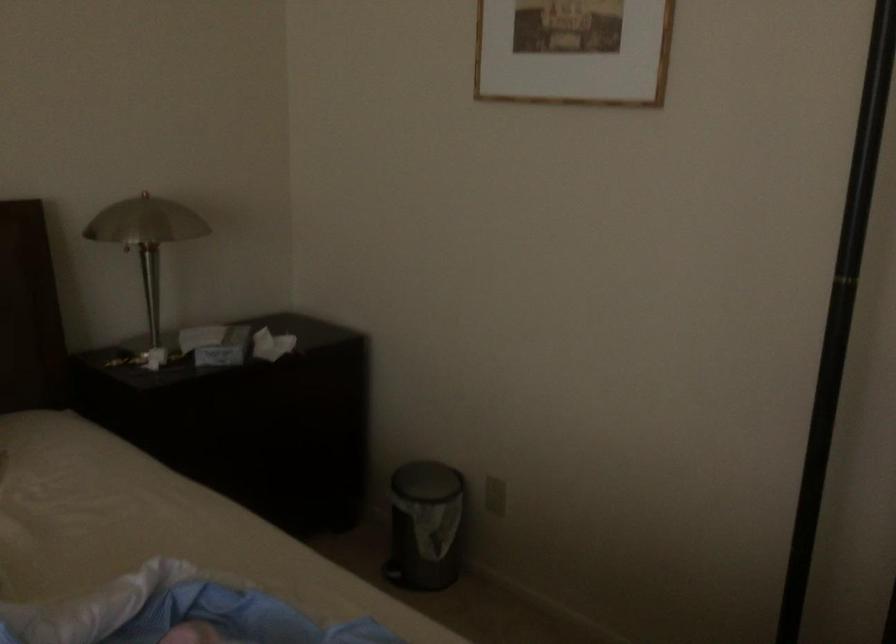
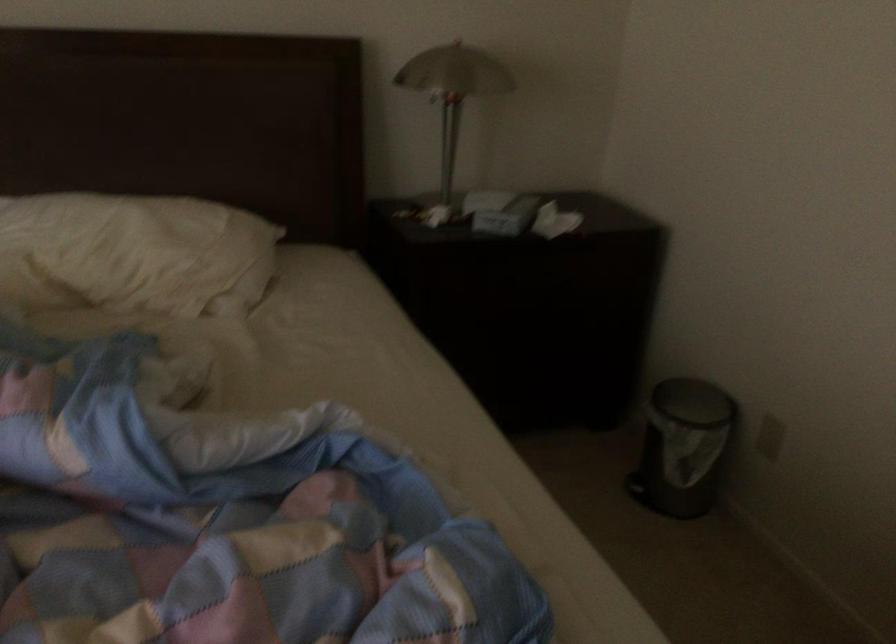
Where in the second image is the point corresponding to the point at 222,344 from the first image?

(501, 212)